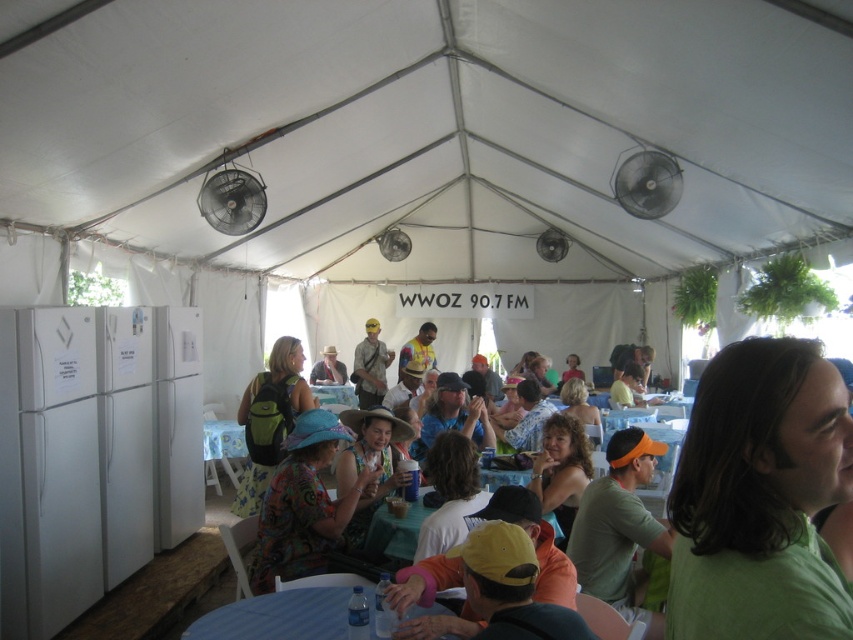
You are standing at the entrance of the tent and see both the green cotton shirt at center and the matte black hat at center. Which object is closer to the entrance?

The green cotton shirt at center is 23.20 feet away from the matte black hat at center. Since the question asks which is closer to the entrance, but the distance between them is provided, not their distances from the entrance, we cannot determine which is closer based on the given information.

You are standing inside the large white tent and want to move from point A to point B. Point A is at coordinate point (622, 577) and point B is at coordinate point (225, 454). Which point is closer to you when you first enter the tent?

Point A at coordinate point (622, 577) is closer to the viewer than point B at coordinate point (225, 454), so when you first enter the tent, point A is closer to you.

You are a guest at an outdoor event and want to place a 10 cm tall souvenir on the blue fabric table at lower left without it falling off. Considering the height of the yellow and blue striped shirt at center, is the table tall enough to ensure the souvenir stays stable?

The blue fabric table at lower left has a greater height compared to the yellow and blue striped shirt at center. Since the shirt is shorter than the table, the 10 cm tall souvenir should be stable on the table as it won not exceed the table height.